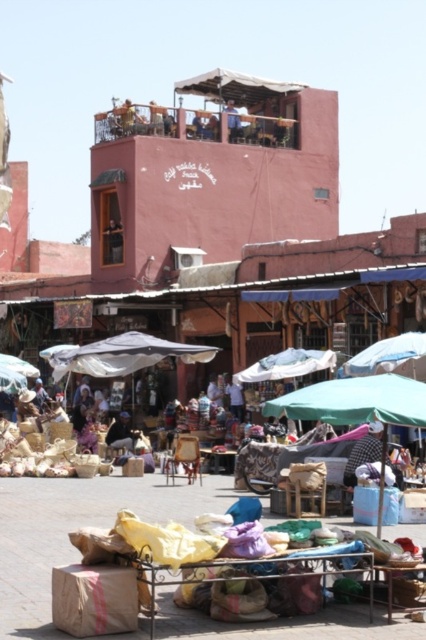
Can you confirm if white cotton shirt at center is positioned above dark blue fabric at center?

Yes.

Does point (354, 472) come in front of point (108, 444)?

Yes, it is.

Measure the distance between point (342,477) and camera.

They are 49.19 meters apart.

Locate an element on the screen. The height and width of the screenshot is (640, 426). white cotton shirt at center is located at coordinates [x=363, y=452].

Does yellow fabric at center appear on the right side of dark blue fabric at center?

Correct, you'll find yellow fabric at center to the right of dark blue fabric at center.

Between yellow fabric at center and dark blue fabric at center, which one is positioned lower?

yellow fabric at center is lower down.

Describe the element at coordinates (77, 528) in the screenshot. I see `yellow fabric at center` at that location.

Where is `yellow fabric at center`? yellow fabric at center is located at coordinates (77, 528).

Is yellow fabric at center bigger than blue fabric umbrella at upper center?

Yes.

Describe the element at coordinates (77, 528) in the screenshot. This screenshot has width=426, height=640. I see `yellow fabric at center` at that location.

The width and height of the screenshot is (426, 640). What are the coordinates of `yellow fabric at center` in the screenshot? It's located at (77, 528).